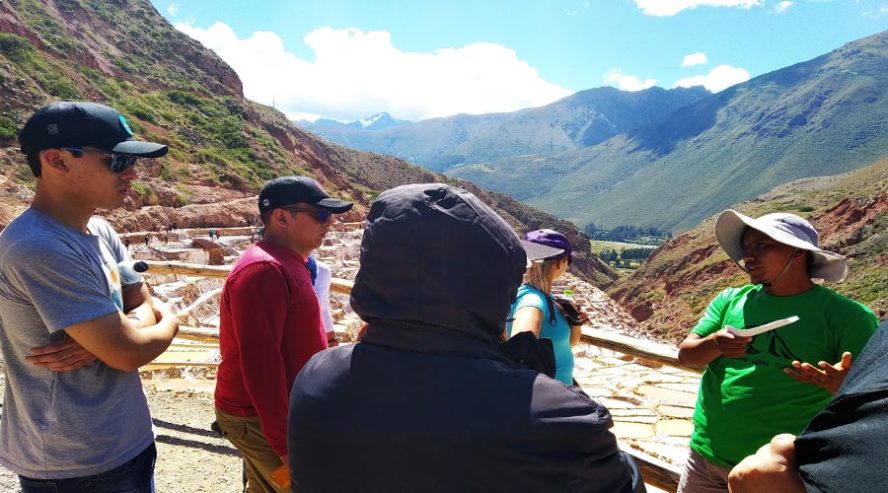
Locate an element on the screen. hood is located at coordinates (465, 284).